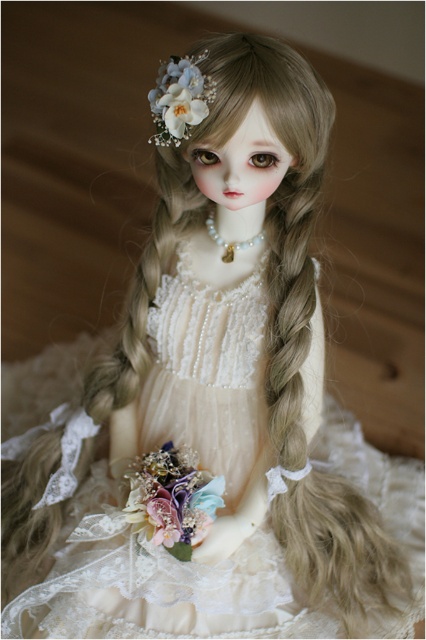
Question: Is floral bouquet at center smaller than white floral hair accessory at upper left?

Choices:
 (A) yes
 (B) no

Answer: (B)

Question: Does floral bouquet at center appear over white floral hair accessory at upper left?

Choices:
 (A) yes
 (B) no

Answer: (B)

Question: In this image, where is floral bouquet at center located relative to white floral hair accessory at upper left?

Choices:
 (A) above
 (B) below

Answer: (B)

Question: Which point is farther to the camera?

Choices:
 (A) (167, 61)
 (B) (164, 460)

Answer: (B)

Question: Among these points, which one is nearest to the camera?

Choices:
 (A) [155, 118]
 (B) [187, 540]

Answer: (A)